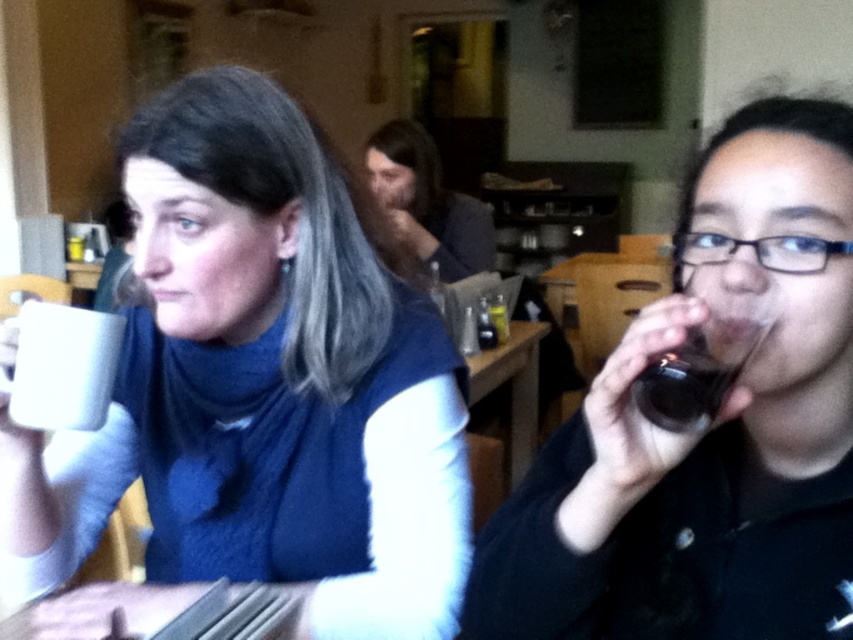
Question: Is white matte mug at upper left further to camera compared to matte black glass at right?

Choices:
 (A) no
 (B) yes

Answer: (B)

Question: Which point appears farthest from the camera in this image?

Choices:
 (A) (508, 374)
 (B) (659, 408)
 (C) (231, 316)
 (D) (384, 192)

Answer: (D)

Question: Among these objects, which one is nearest to the camera?

Choices:
 (A) wooden table at center
 (B) white matte mug at upper left
 (C) matte black glass at right

Answer: (C)

Question: Can you confirm if white matte mug at upper left is wider than wooden table at center?

Choices:
 (A) yes
 (B) no

Answer: (A)

Question: Is matte black glass at right below matte gray sweater at center?

Choices:
 (A) yes
 (B) no

Answer: (A)

Question: Based on their relative distances, which object is nearer to the dark brown liquid at right?

Choices:
 (A) matte gray sweater at center
 (B) white matte mug at upper left
 (C) matte black glass at right
 (D) wooden table at center

Answer: (C)